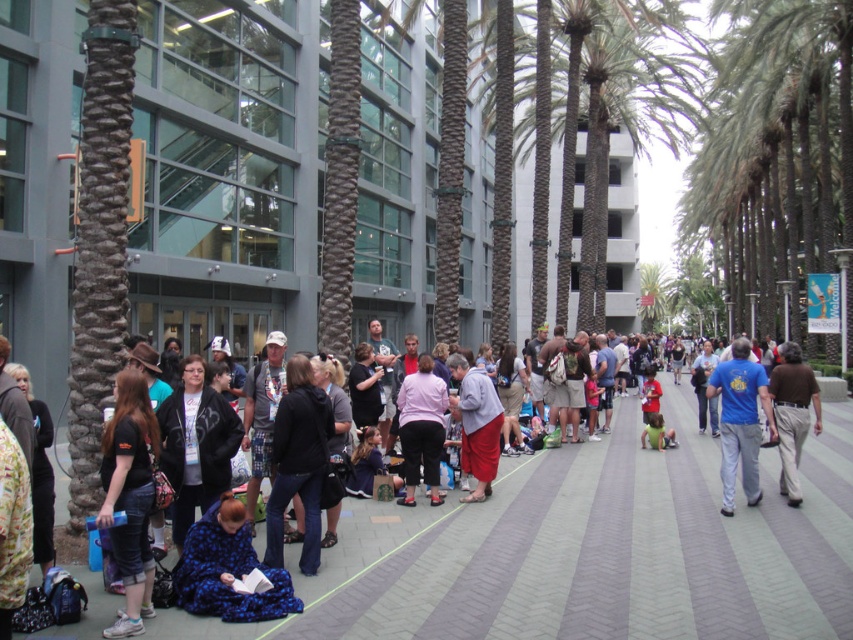
From the picture: Between matte black shirt at lower left and blue t-shirt at center, which one appears on the left side from the viewer's perspective?

matte black shirt at lower left

Is point (131, 417) more distant than point (741, 470)?

That is False.

Locate an element on the screen. Image resolution: width=853 pixels, height=640 pixels. matte black shirt at lower left is located at coordinates (129, 496).

Is point (740, 394) positioned after point (473, 458)?

No, it is not.

Does blue t-shirt at center have a larger size compared to gray wool sweater at center?

No.

This screenshot has height=640, width=853. Describe the element at coordinates (740, 420) in the screenshot. I see `blue t-shirt at center` at that location.

The height and width of the screenshot is (640, 853). Find the location of `blue t-shirt at center`. blue t-shirt at center is located at coordinates (740, 420).

Is gray striped pavement at center wider than brown cotton shirt at right?

Yes.

Locate an element on the screen. The image size is (853, 640). gray striped pavement at center is located at coordinates click(x=616, y=548).